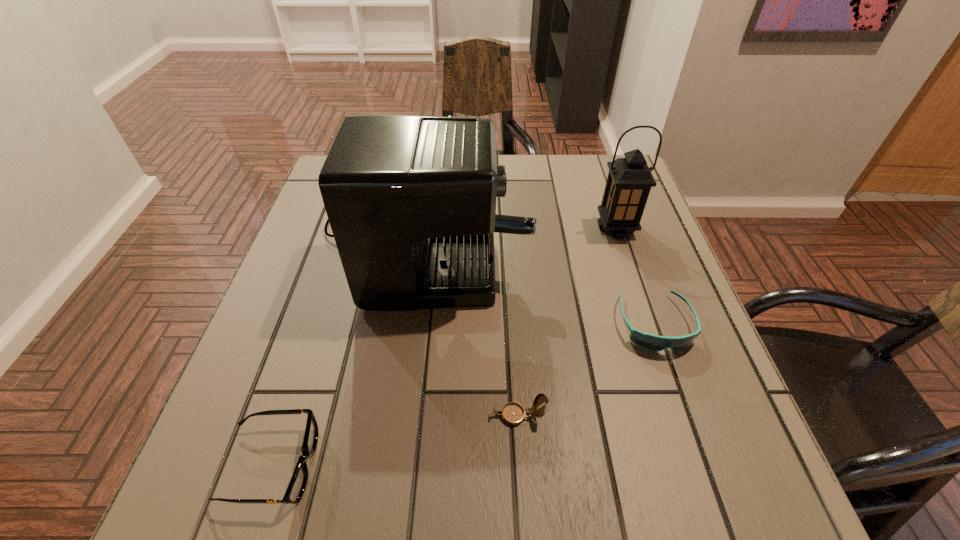
The width and height of the screenshot is (960, 540). What are the coordinates of `vacant space at the far edge` in the screenshot? It's located at (571, 185).

Where is `vacant space at the near edge of the desktop`? The image size is (960, 540). vacant space at the near edge of the desktop is located at coordinates (564, 465).

The width and height of the screenshot is (960, 540). I want to click on free space at the left edge of the desktop, so click(339, 284).

Image resolution: width=960 pixels, height=540 pixels. In the image, there is a desktop. Identify the location of free region at the right edge. (600, 235).

You are a GUI agent. You are given a task and a screenshot of the screen. Output one action in this format:
    pyautogui.click(x=<x>, y=<y>)
    Task: Click on the blank space at the near left corner of the desktop
    
    Given the screenshot: What is the action you would take?
    pyautogui.click(x=267, y=482)

In order to click on vacant area at the near right corner in this screenshot , I will do `click(732, 509)`.

Where is `free spot between the second tallest object and the right sunglasses`? Image resolution: width=960 pixels, height=540 pixels. free spot between the second tallest object and the right sunglasses is located at coordinates (636, 276).

Image resolution: width=960 pixels, height=540 pixels. I want to click on free area in between the farther sunglasses and the nearer sunglasses, so click(464, 394).

Where is `unoccupied position between the left sunglasses and the farther sunglasses`? Image resolution: width=960 pixels, height=540 pixels. unoccupied position between the left sunglasses and the farther sunglasses is located at coordinates (464, 394).

You are a GUI agent. You are given a task and a screenshot of the screen. Output one action in this format:
    pyautogui.click(x=<x>, y=<y>)
    Task: Click on the vacant space that's between the tallest object and the left sunglasses
    The image size is (960, 540).
    Given the screenshot: What is the action you would take?
    pyautogui.click(x=349, y=344)